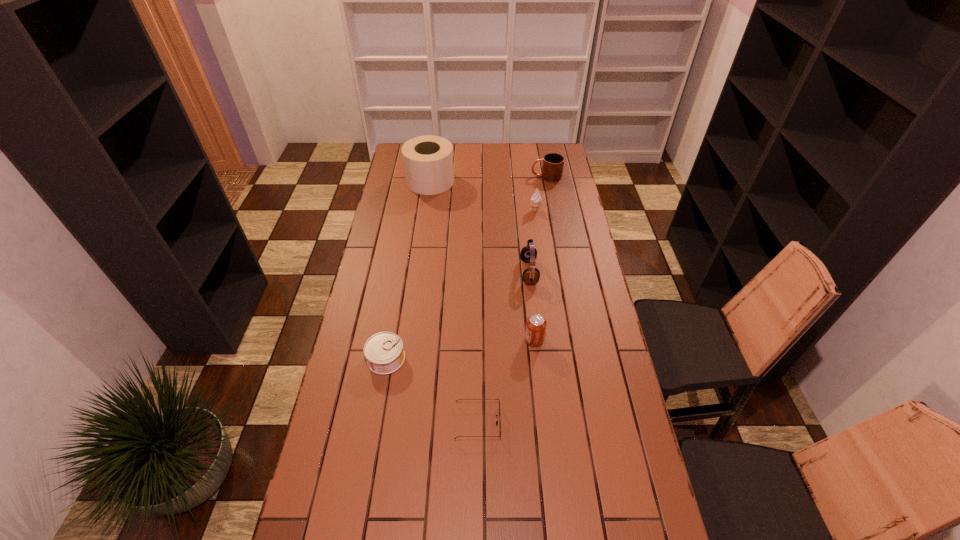
Locate an element on the screen. The height and width of the screenshot is (540, 960). toilet tissue is located at coordinates (428, 163).

The image size is (960, 540). In order to click on the fourth nearest object in this screenshot , I will do `click(528, 254)`.

In order to click on icecream in this screenshot , I will do `click(536, 199)`.

Where is `the right can`? This screenshot has height=540, width=960. the right can is located at coordinates (536, 324).

At what (x,y) coordinates should I click in order to perform the action: click on mug. Please return your answer as a coordinate pair (x, y). Looking at the image, I should click on (552, 169).

You are a GUI agent. You are given a task and a screenshot of the screen. Output one action in this format:
    pyautogui.click(x=<x>, y=<y>)
    Task: Click on the sixth tallest object
    This screenshot has height=540, width=960.
    Given the screenshot: What is the action you would take?
    [384, 353]

Locate an element on the screen. This screenshot has width=960, height=540. the left can is located at coordinates (384, 353).

Where is `sunglasses`? This screenshot has height=540, width=960. sunglasses is located at coordinates (458, 399).

Find the location of a particular element. The width and height of the screenshot is (960, 540). the shortest object is located at coordinates (458, 399).

The image size is (960, 540). I want to click on blank space located on the right of the toilet tissue, so click(465, 181).